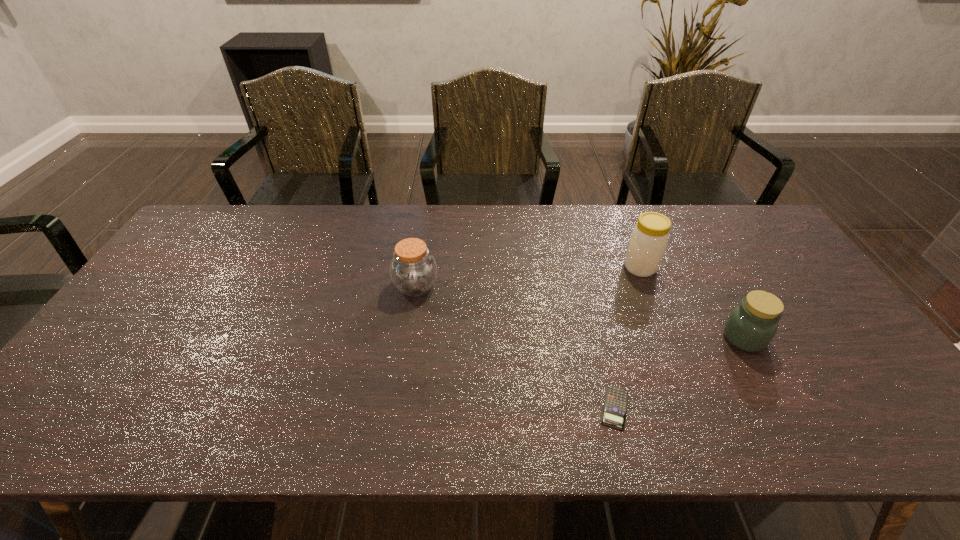
Identify the location of the second jar from left to right. (649, 238).

Image resolution: width=960 pixels, height=540 pixels. I want to click on the third object from left to right, so click(649, 238).

The image size is (960, 540). Identify the location of the leftmost object. (413, 270).

Where is `the second nearest object`? Image resolution: width=960 pixels, height=540 pixels. the second nearest object is located at coordinates (751, 326).

This screenshot has height=540, width=960. I want to click on the rightmost object, so click(751, 326).

At what (x,y) coordinates should I click in order to perform the action: click on the nearest object. Please return your answer as a coordinate pair (x, y). Looking at the image, I should click on (615, 406).

The width and height of the screenshot is (960, 540). What are the coordinates of `calculator` in the screenshot? It's located at (x=615, y=406).

The width and height of the screenshot is (960, 540). Find the location of `free space located on the front of the tallest object`. free space located on the front of the tallest object is located at coordinates click(659, 314).

Identify the location of free location located on the back of the leftmost jar. Image resolution: width=960 pixels, height=540 pixels. (422, 242).

This screenshot has width=960, height=540. In order to click on blank area located 0.390m on the back of the rightmost object in this screenshot , I will do `click(685, 234)`.